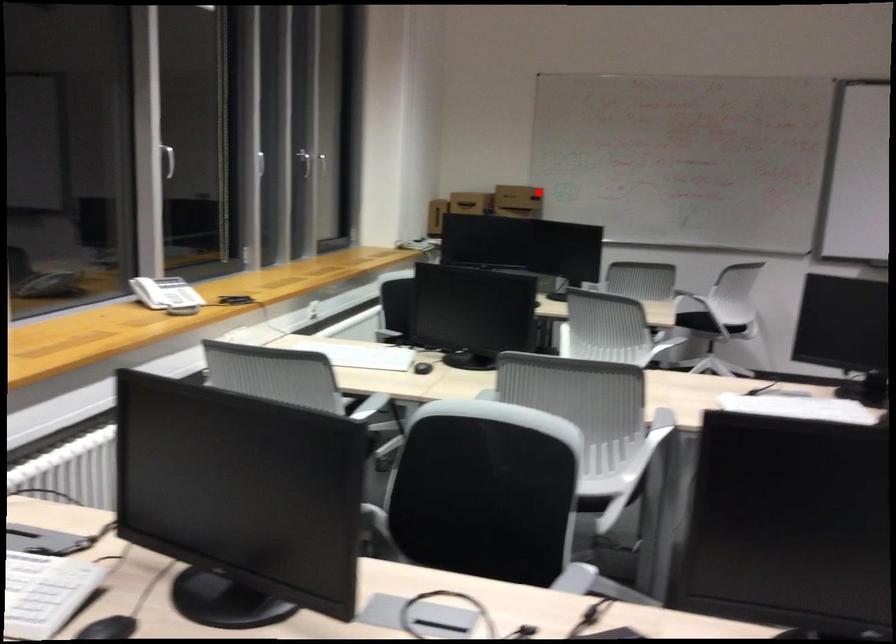
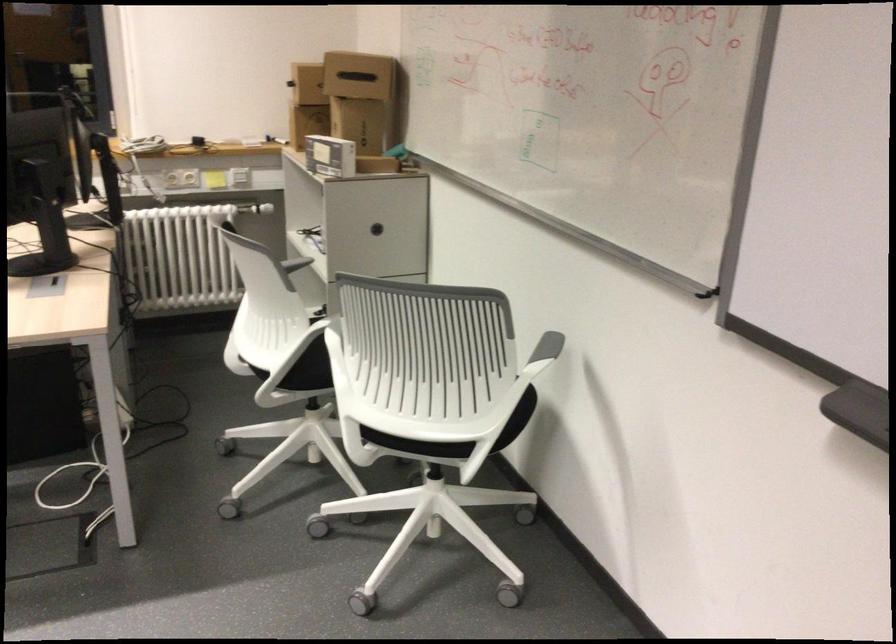
Question: A red point is marked in image1. In image2, is the corresponding 3D point closer to the camera or farther? Reply with the corresponding letter.

Choices:
 (A) The corresponding 3D point is closer.
 (B) The corresponding 3D point is farther.

Answer: (A)